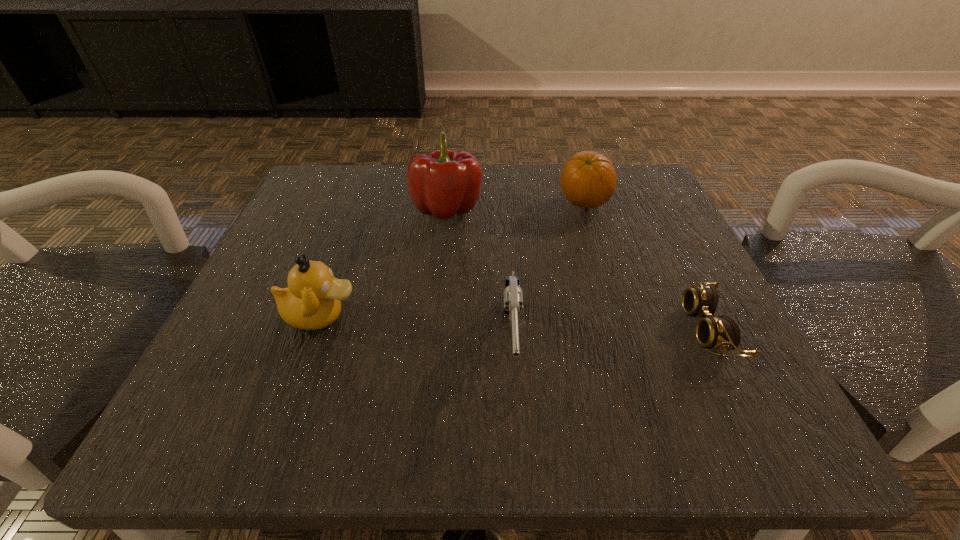
Identify the location of vacant region located through the lenses of the rightmost object. The width and height of the screenshot is (960, 540). [437, 329].

The image size is (960, 540). Identify the location of free spot located through the lenses of the rightmost object. (497, 329).

You are a GUI agent. You are given a task and a screenshot of the screen. Output one action in this format:
    pyautogui.click(x=<x>, y=<y>)
    Task: Click on the pepper located in the far edge section of the desktop
    The height and width of the screenshot is (540, 960).
    Given the screenshot: What is the action you would take?
    pyautogui.click(x=442, y=183)

This screenshot has width=960, height=540. I want to click on orange situated at the far edge, so click(588, 180).

Locate an element on the screen. object that is at the near edge is located at coordinates (513, 295).

The height and width of the screenshot is (540, 960). In order to click on object at the left edge in this screenshot , I will do `click(312, 301)`.

Locate an element on the screen. orange present at the right edge is located at coordinates (588, 180).

You are a GUI agent. You are given a task and a screenshot of the screen. Output one action in this format:
    pyautogui.click(x=<x>, y=<y>)
    Task: Click on the goggles situated at the right edge
    Image resolution: width=960 pixels, height=540 pixels.
    Given the screenshot: What is the action you would take?
    pyautogui.click(x=722, y=332)

Where is `object that is at the far right corner`? Image resolution: width=960 pixels, height=540 pixels. object that is at the far right corner is located at coordinates (588, 180).

Identify the location of free point at the far edge. The height and width of the screenshot is (540, 960). (534, 214).